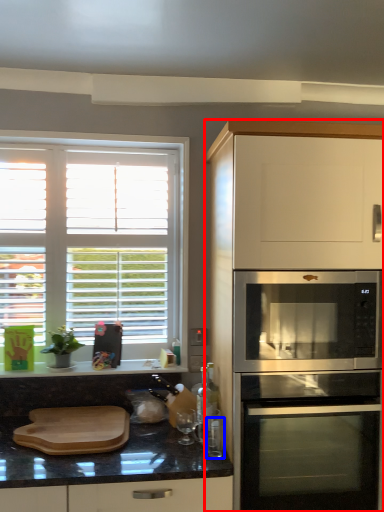
Question: Which object is further to the camera taking this photo, cabinetry (highlighted by a red box) or appliance (highlighted by a blue box)?

Choices:
 (A) cabinetry
 (B) appliance

Answer: (B)